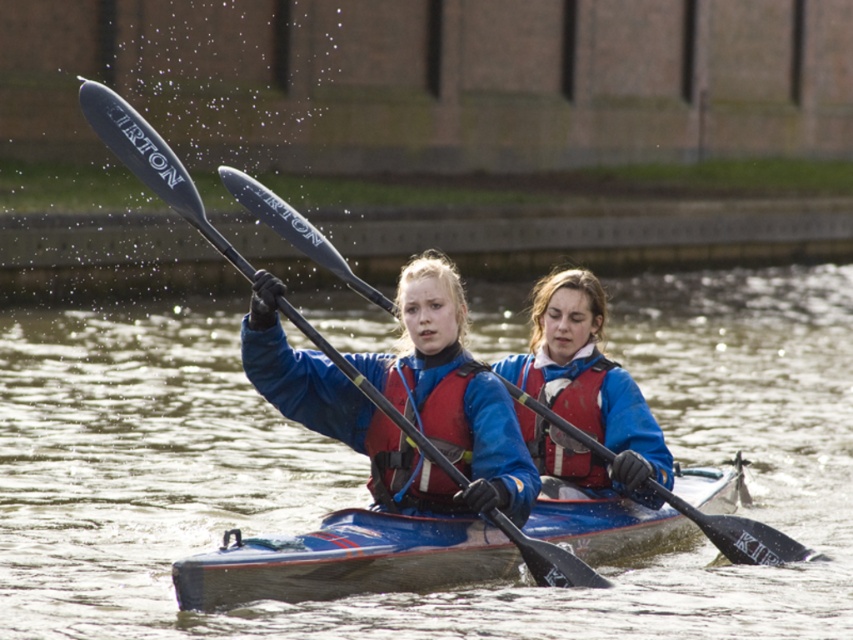
You are planning to store the matte blue kayak at center and the red matte life jacket at center in a vertical storage rack. Which item should be placed first to ensure both fit properly?

The matte blue kayak at center should be placed first in the vertical storage rack because it has a lesser height compared to the red matte life jacket at center, allowing the taller life jacket to be positioned above it without exceeding the rack height limits.

Looking at this image, you are a safety inspector checking the equipment on the blue kayak. You notice the red matte life jacket at center and the black glossy paddle at center. Which object is wider?

The black glossy paddle at center is wider than the red matte life jacket at center.

You are planning to store the blue glossy kayak at center and the matte red life vest at center in a vertical locker. Given their heights, which object might not fit if the locker has limited vertical space?

The blue glossy kayak at center has a lesser height compared to the matte red life vest at center. Therefore, the matte red life vest at center might not fit in the vertical locker due to its greater height.